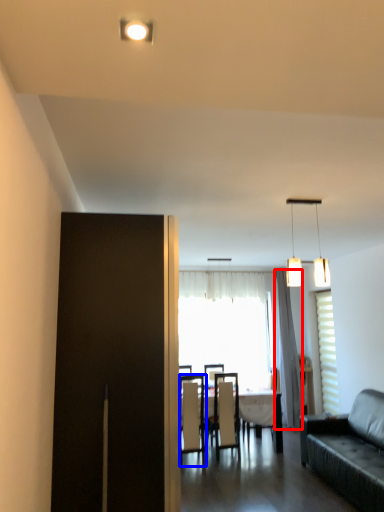
Question: Among these objects, which one is farthest to the camera, curtain (highlighted by a red box) or chair (highlighted by a blue box)?

Choices:
 (A) curtain
 (B) chair

Answer: (A)